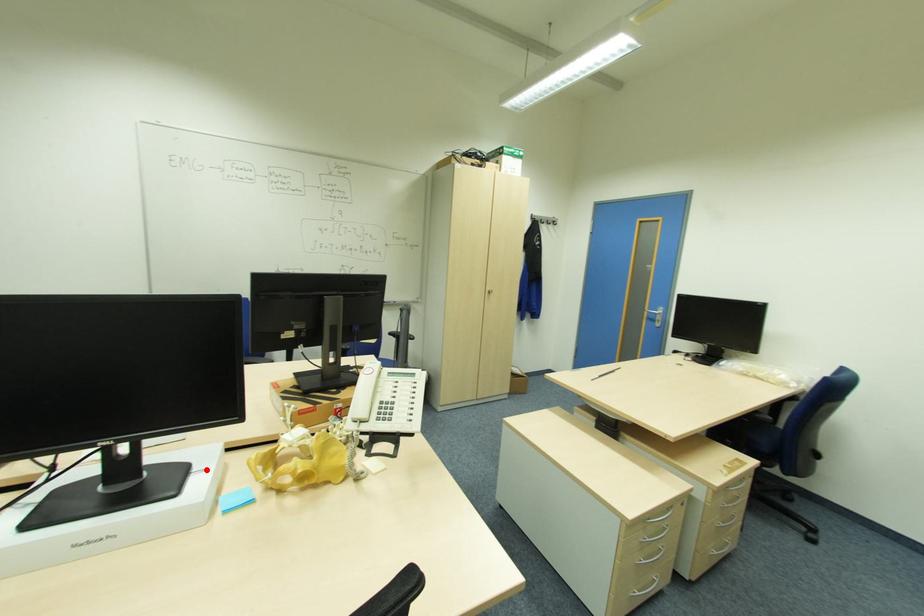
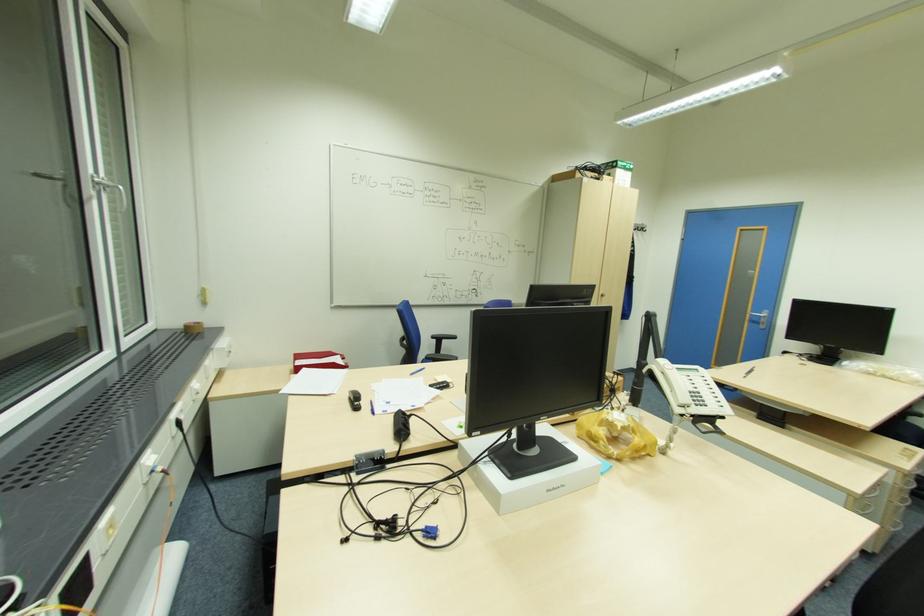
Where in the second image is the point corresponding to the highlighted location from the first image?

(568, 442)